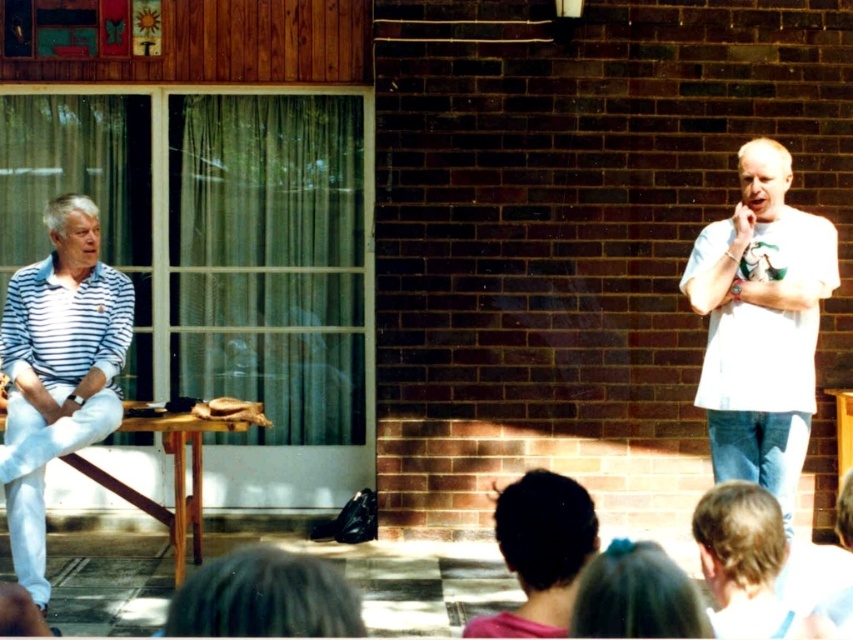
Question: Which point is closer to the camera taking this photo?

Choices:
 (A) (6, 432)
 (B) (695, 296)

Answer: (B)

Question: Does white cotton shirt at right lie behind white striped polo shirt at left?

Choices:
 (A) yes
 (B) no

Answer: (B)

Question: Is the position of white cotton shirt at right less distant than that of white striped polo shirt at left?

Choices:
 (A) no
 (B) yes

Answer: (B)

Question: Which object appears closest to the camera in this image?

Choices:
 (A) white cotton shirt at right
 (B) white striped polo shirt at left

Answer: (A)

Question: Is white cotton shirt at right thinner than white striped polo shirt at left?

Choices:
 (A) no
 (B) yes

Answer: (A)